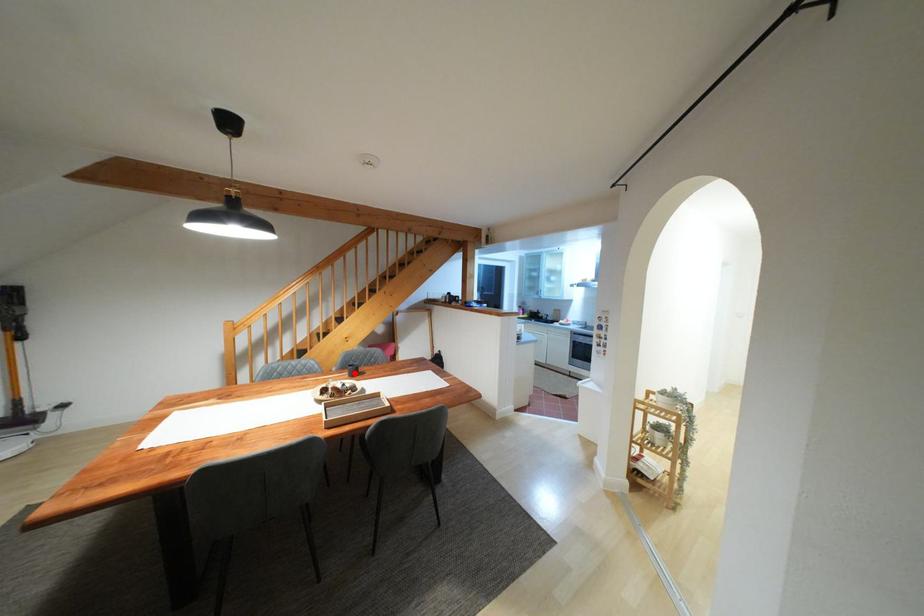
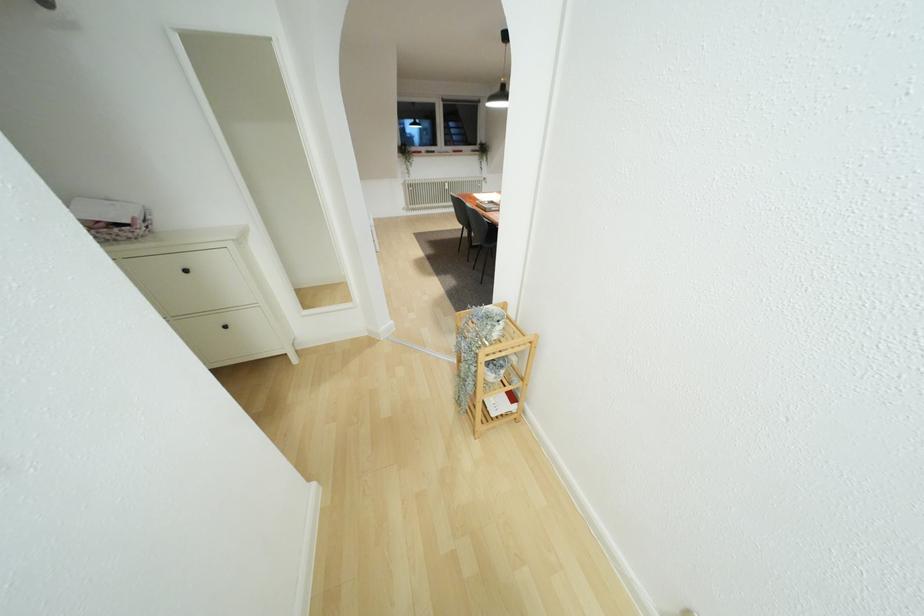
Question: I am providing you with two images of the same scene from different viewpoints. A red point is marked on the first image. Can you still see the location of the red point in image 2?

Choices:
 (A) Yes
 (B) No

Answer: (B)